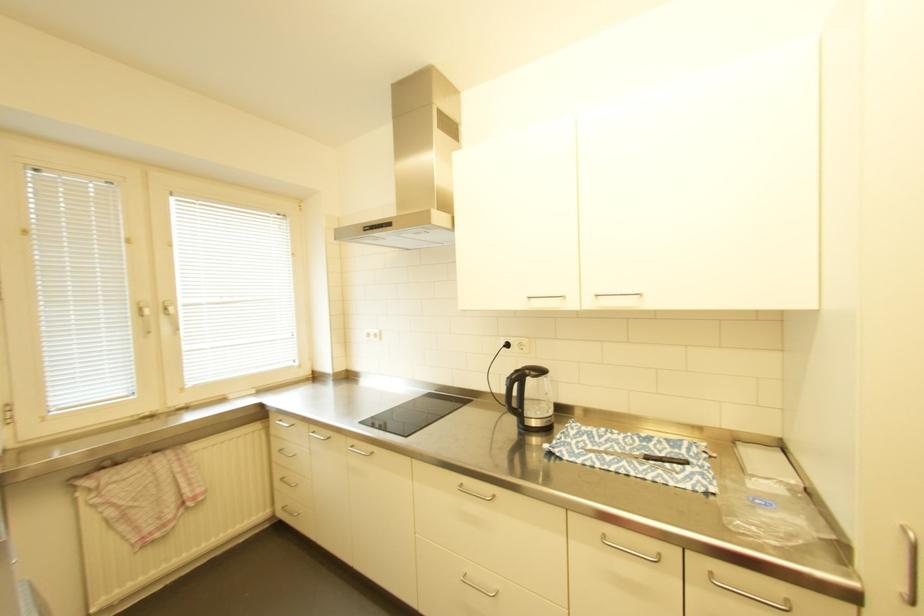
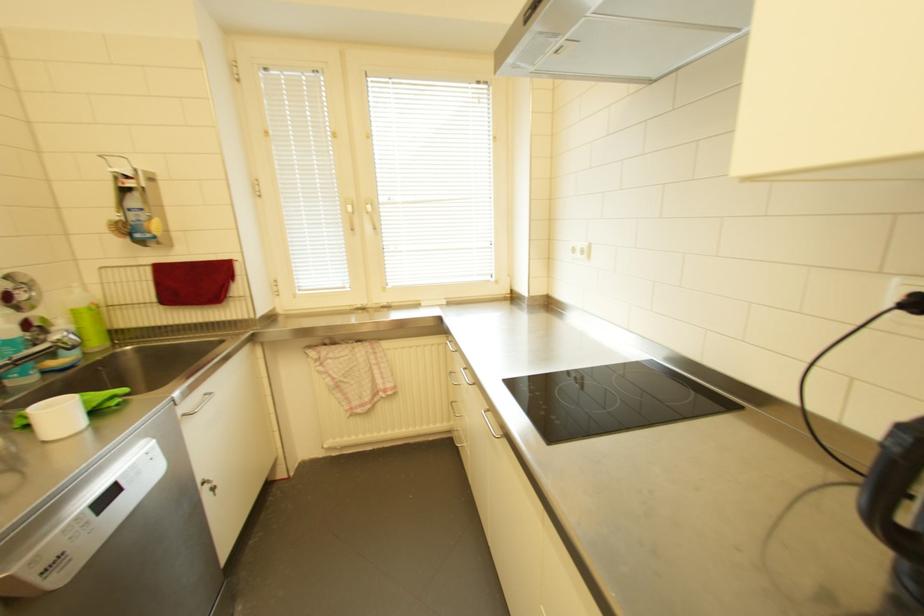
Question: The camera is either moving clockwise (left) or counter-clockwise (right) around the object. The first image is from the beginning of the video and the second image is from the end. Is the camera moving left or right when shooting the video?

Choices:
 (A) Left
 (B) Right

Answer: (B)